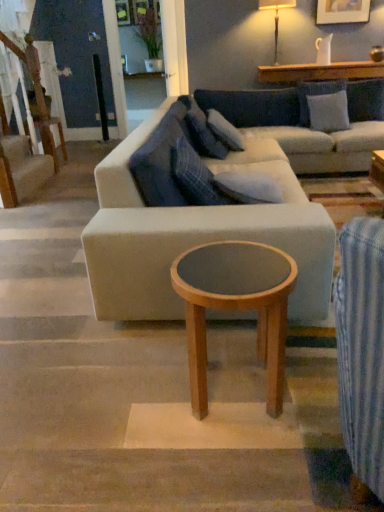
Identify the location of vacant space underneath light brown wood coffee table at center (from a real-world perspective). (236, 390).